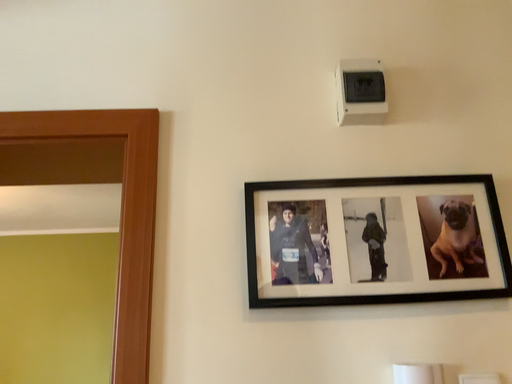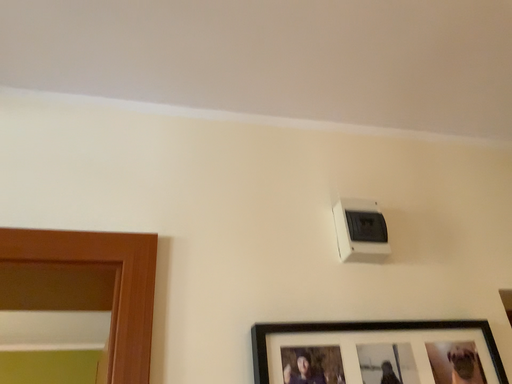
Question: How did the camera likely rotate when shooting the video?

Choices:
 (A) rotated left
 (B) rotated right

Answer: (B)